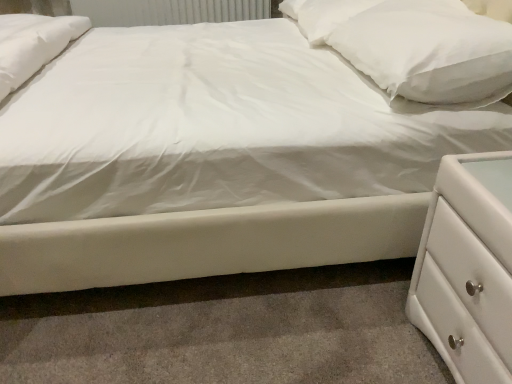
This screenshot has height=384, width=512. What do you see at coordinates (468, 268) in the screenshot? I see `white glossy chest of drawers at lower right` at bounding box center [468, 268].

Locate an element on the screen. white soft pillow at upper right, the 1th pillow when ordered from front to back is located at coordinates tap(414, 46).

The width and height of the screenshot is (512, 384). Describe the element at coordinates (414, 46) in the screenshot. I see `white soft pillow at upper right, the 1th pillow when ordered from front to back` at that location.

You are a GUI agent. You are given a task and a screenshot of the screen. Output one action in this format:
    pyautogui.click(x=<x>, y=<y>)
    Task: Click on the white glossy chest of drawers at lower right
    The image size is (512, 384).
    Given the screenshot: What is the action you would take?
    pyautogui.click(x=468, y=268)

Is white textured radiator at upper center aimed at white soft pillow at upper right, the 2th pillow when ordered from back to front?

Yes, white textured radiator at upper center faces towards white soft pillow at upper right, the 2th pillow when ordered from back to front.

Would you say white textured radiator at upper center contains white soft pillow at upper right, the 2th pillow when ordered from back to front?

No, white textured radiator at upper center does not contain white soft pillow at upper right, the 2th pillow when ordered from back to front.

Is white textured radiator at upper center touching white soft pillow at upper right, the 1th pillow when ordered from front to back?

There is a gap between white textured radiator at upper center and white soft pillow at upper right, the 1th pillow when ordered from front to back.

In terms of size, does white textured radiator at upper center appear bigger or smaller than white soft pillow at upper right, the 2th pillow when ordered from back to front?

Clearly, white textured radiator at upper center is larger in size than white soft pillow at upper right, the 2th pillow when ordered from back to front.

Can you confirm if white soft pillow at upper right, the 1th pillow in the back-to-front sequence, is positioned to the right of white glossy chest of drawers at lower right?

No.

Which object is further away from the camera taking this photo, white soft pillow at upper right, the 1th pillow in the back-to-front sequence, or white glossy chest of drawers at lower right?

white soft pillow at upper right, the 1th pillow in the back-to-front sequence, is behind.

In terms of width, does white soft pillow at upper right, which ranks as the 2th pillow in front-to-back order, look wider or thinner when compared to white glossy chest of drawers at lower right?

white soft pillow at upper right, which ranks as the 2th pillow in front-to-back order, is wider than white glossy chest of drawers at lower right.

Based on the photo, are white soft pillow at upper right, the 1th pillow in the back-to-front sequence, and white glossy chest of drawers at lower right beside each other?

No.

Is white glossy chest of drawers at lower right wider than white soft pillow at upper right, the 1th pillow when ordered from front to back?

No, white glossy chest of drawers at lower right is not wider than white soft pillow at upper right, the 1th pillow when ordered from front to back.

From a real-world perspective, is white glossy chest of drawers at lower right located higher than white soft pillow at upper right, the 2th pillow when ordered from back to front?

Actually, white glossy chest of drawers at lower right is physically below white soft pillow at upper right, the 2th pillow when ordered from back to front, in the real world.

What's the angular difference between white glossy chest of drawers at lower right and white soft pillow at upper right, the 2th pillow when ordered from back to front,'s facing directions?

0.761 degrees separate the facing orientations of white glossy chest of drawers at lower right and white soft pillow at upper right, the 2th pillow when ordered from back to front.

Is white textured radiator at upper center completely or partially outside of white soft pillow at upper right, the 1th pillow in the back-to-front sequence?

Indeed, white textured radiator at upper center is completely outside white soft pillow at upper right, the 1th pillow in the back-to-front sequence.

What's the angular difference between white textured radiator at upper center and white soft pillow at upper right, which ranks as the 2th pillow in front-to-back order,'s facing directions?

The angle between the facing direction of white textured radiator at upper center and the facing direction of white soft pillow at upper right, which ranks as the 2th pillow in front-to-back order, is 90.8 degrees.

Are white textured radiator at upper center and white soft pillow at upper right, the 1th pillow in the back-to-front sequence, far apart?

Absolutely, white textured radiator at upper center is distant from white soft pillow at upper right, the 1th pillow in the back-to-front sequence.

Based on their sizes in the image, would you say white textured radiator at upper center is bigger or smaller than white soft pillow at upper right, the 1th pillow in the back-to-front sequence?

Considering their sizes, white textured radiator at upper center takes up more space than white soft pillow at upper right, the 1th pillow in the back-to-front sequence.

In the image, is white soft pillow at upper right, which ranks as the 2th pillow in front-to-back order, positioned in front of or behind white soft pillow at upper right, the 1th pillow when ordered from front to back?

Clearly, white soft pillow at upper right, which ranks as the 2th pillow in front-to-back order, is behind white soft pillow at upper right, the 1th pillow when ordered from front to back.

From the picture: Considering the relative positions of white soft pillow at upper right, which ranks as the 2th pillow in front-to-back order, and white soft pillow at upper right, the 1th pillow when ordered from front to back, in the image provided, is white soft pillow at upper right, which ranks as the 2th pillow in front-to-back order, to the right of white soft pillow at upper right, the 1th pillow when ordered from front to back, from the viewer's perspective?

In fact, white soft pillow at upper right, which ranks as the 2th pillow in front-to-back order, is to the left of white soft pillow at upper right, the 1th pillow when ordered from front to back.

Is white soft pillow at upper right, the 1th pillow in the back-to-front sequence, far from white soft pillow at upper right, the 2th pillow when ordered from back to front?

white soft pillow at upper right, the 1th pillow in the back-to-front sequence, is actually quite close to white soft pillow at upper right, the 2th pillow when ordered from back to front.

In the scene shown: Can you confirm if white soft pillow at upper right, the 1th pillow in the back-to-front sequence, is thinner than white soft pillow at upper right, the 2th pillow when ordered from back to front?

Incorrect, the width of white soft pillow at upper right, the 1th pillow in the back-to-front sequence, is not less than that of white soft pillow at upper right, the 2th pillow when ordered from back to front.

Does white glossy chest of drawers at lower right have a larger size compared to white textured radiator at upper center?

Incorrect, white glossy chest of drawers at lower right is not larger than white textured radiator at upper center.

Do you think white glossy chest of drawers at lower right is within white textured radiator at upper center, or outside of it?

white glossy chest of drawers at lower right is located beyond the bounds of white textured radiator at upper center.

From the image's perspective, does white glossy chest of drawers at lower right appear higher than white textured radiator at upper center?

No, from the image's perspective, white glossy chest of drawers at lower right is not above white textured radiator at upper center.

Can you tell me how much white soft pillow at upper right, the 1th pillow when ordered from front to back, and white glossy chest of drawers at lower right differ in facing direction?

0.761 degrees separate the facing orientations of white soft pillow at upper right, the 1th pillow when ordered from front to back, and white glossy chest of drawers at lower right.

From the image's perspective, which one is positioned higher, white soft pillow at upper right, the 1th pillow when ordered from front to back, or white glossy chest of drawers at lower right?

white soft pillow at upper right, the 1th pillow when ordered from front to back, is shown above in the image.

Is white soft pillow at upper right, the 2th pillow when ordered from back to front, positioned with its back to white glossy chest of drawers at lower right?

white soft pillow at upper right, the 2th pillow when ordered from back to front, is not turned away from white glossy chest of drawers at lower right.

This screenshot has width=512, height=384. Identify the location of the 2nd pillow in front of the white textured radiator at upper center, counting from the anchor's position. (414, 46).

This screenshot has height=384, width=512. I want to click on the chest of drawers below the white soft pillow at upper right, which ranks as the 2th pillow in front-to-back order (from the image's perspective), so click(x=468, y=268).

Which object lies further to the anchor point white textured radiator at upper center, white soft pillow at upper right, the 2th pillow when ordered from back to front, or white soft pillow at upper right, the 1th pillow in the back-to-front sequence?

The object further to white textured radiator at upper center is white soft pillow at upper right, the 2th pillow when ordered from back to front.

In the scene shown: Based on their spatial positions, is white textured radiator at upper center or white soft pillow at upper right, which ranks as the 2th pillow in front-to-back order, further from white soft pillow at upper right, the 2th pillow when ordered from back to front?

white textured radiator at upper center lies further to white soft pillow at upper right, the 2th pillow when ordered from back to front, than the other object.

When comparing their distances from white textured radiator at upper center, does white soft pillow at upper right, which ranks as the 2th pillow in front-to-back order, or white soft pillow at upper right, the 1th pillow when ordered from front to back, seem closer?

white soft pillow at upper right, which ranks as the 2th pillow in front-to-back order.

Based on their spatial positions, is white soft pillow at upper right, the 2th pillow when ordered from back to front, or white textured radiator at upper center closer to white glossy chest of drawers at lower right?

Based on the image, white soft pillow at upper right, the 2th pillow when ordered from back to front, appears to be nearer to white glossy chest of drawers at lower right.

Looking at the image, which one is located closer to white soft pillow at upper right, the 1th pillow when ordered from front to back, white soft pillow at upper right, the 1th pillow in the back-to-front sequence, or white glossy chest of drawers at lower right?

Among the two, white soft pillow at upper right, the 1th pillow in the back-to-front sequence, is located nearer to white soft pillow at upper right, the 1th pillow when ordered from front to back.

Which object lies further to the anchor point white soft pillow at upper right, the 1th pillow in the back-to-front sequence, white glossy chest of drawers at lower right or white textured radiator at upper center?

The object further to white soft pillow at upper right, the 1th pillow in the back-to-front sequence, is white textured radiator at upper center.

Based on their spatial positions, is white glossy chest of drawers at lower right or white soft pillow at upper right, the 2th pillow when ordered from back to front, further from white textured radiator at upper center?

white glossy chest of drawers at lower right is further to white textured radiator at upper center.

From the image, which object appears to be nearer to white soft pillow at upper right, the 1th pillow in the back-to-front sequence, white soft pillow at upper right, the 1th pillow when ordered from front to back, or white glossy chest of drawers at lower right?

The object closer to white soft pillow at upper right, the 1th pillow in the back-to-front sequence, is white soft pillow at upper right, the 1th pillow when ordered from front to back.

Where is `pillow between white soft pillow at upper right, the 1th pillow in the back-to-front sequence, and white glossy chest of drawers at lower right vertically`? pillow between white soft pillow at upper right, the 1th pillow in the back-to-front sequence, and white glossy chest of drawers at lower right vertically is located at coordinates (414, 46).

At what (x,y) coordinates should I click in order to perform the action: click on pillow between white soft pillow at upper right, the 1th pillow when ordered from front to back, and white textured radiator at upper center from front to back. Please return your answer as a coordinate pair (x, y). Looking at the image, I should click on (323, 15).